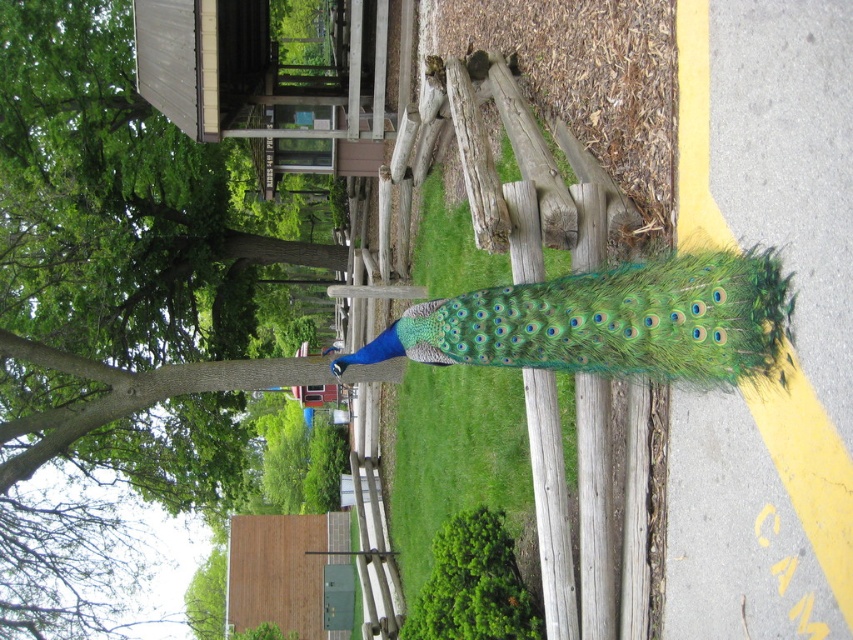
You are a gardener who wants to place a small decorative stone between the green leafy grass at center and the green iridescent feathers at center. If the stone is 2 feet in length, will there be enough space between them to fit the stone?

The distance between the green leafy grass at center and the green iridescent feathers at center is 7.65 feet. Since the stone is only 2 feet long, there is sufficient space to place it between them.

You are a photographer aiming to capture the peacock in the image. You want to ensure the green leafy grass at center and green iridescent feathers at center are both visible in your shot. Which object should you focus on to include both in the frame?

The green leafy grass at center has a smaller width compared to the green iridescent feathers at center. To include both in the frame, focus on the green iridescent feathers at center as it is wider and will allow the narrower green leafy grass at center to fit within the same shot.

You are standing in the park and see the green leafy tree at center and the green iridescent feathers at center. Which object is positioned to the left of the other?

The green leafy tree at center is to the left of green iridescent feathers at center.